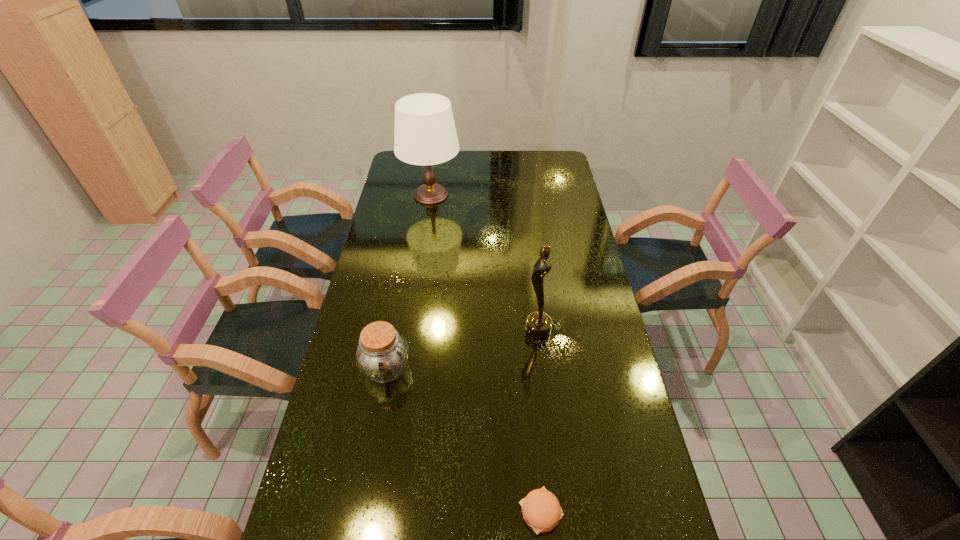
Where is `free space that is in between the farthest object and the patty`? The width and height of the screenshot is (960, 540). free space that is in between the farthest object and the patty is located at coordinates (486, 353).

At what (x,y) coordinates should I click in order to perform the action: click on empty space between the jar and the nearest object. Please return your answer as a coordinate pair (x, y). Looking at the image, I should click on (464, 440).

Locate an element on the screen. free space between the second farthest object and the farthest object is located at coordinates (485, 263).

I want to click on free area in between the third tallest object and the nearest object, so click(464, 440).

Where is `blank region between the third shortest object and the farthest object`? Image resolution: width=960 pixels, height=540 pixels. blank region between the third shortest object and the farthest object is located at coordinates (485, 263).

At what (x,y) coordinates should I click in order to perform the action: click on vacant space that's between the third shortest object and the farthest object. Please return your answer as a coordinate pair (x, y). The width and height of the screenshot is (960, 540). Looking at the image, I should click on (485, 263).

Locate an element on the screen. Image resolution: width=960 pixels, height=540 pixels. empty space between the lamp and the nearest object is located at coordinates (486, 353).

Find the location of a particular element. The width and height of the screenshot is (960, 540). free space between the farthest object and the nearest object is located at coordinates (486, 353).

Locate an element on the screen. vacant point located between the second nearest object and the lamp is located at coordinates (409, 282).

Where is `object that is the third closest to the patty`? The width and height of the screenshot is (960, 540). object that is the third closest to the patty is located at coordinates (425, 134).